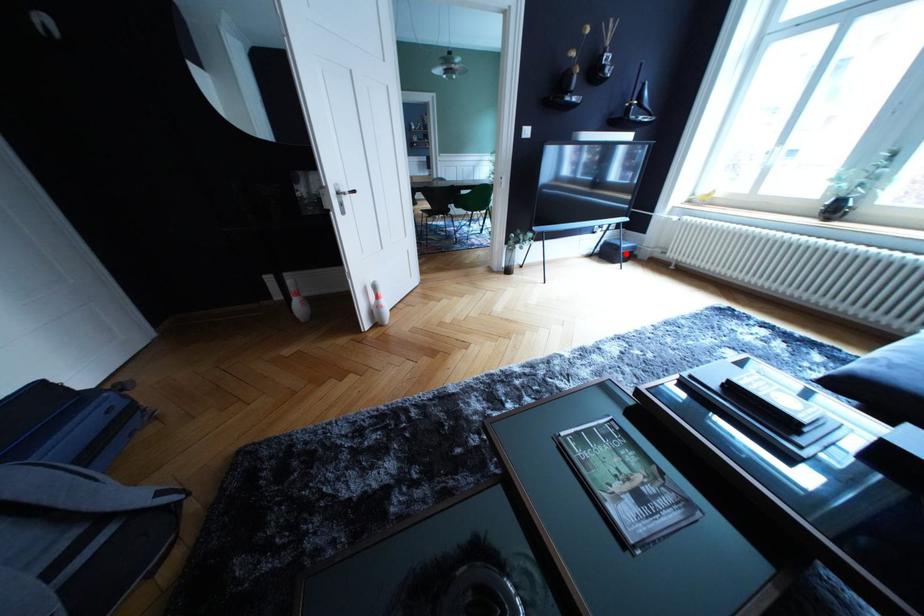
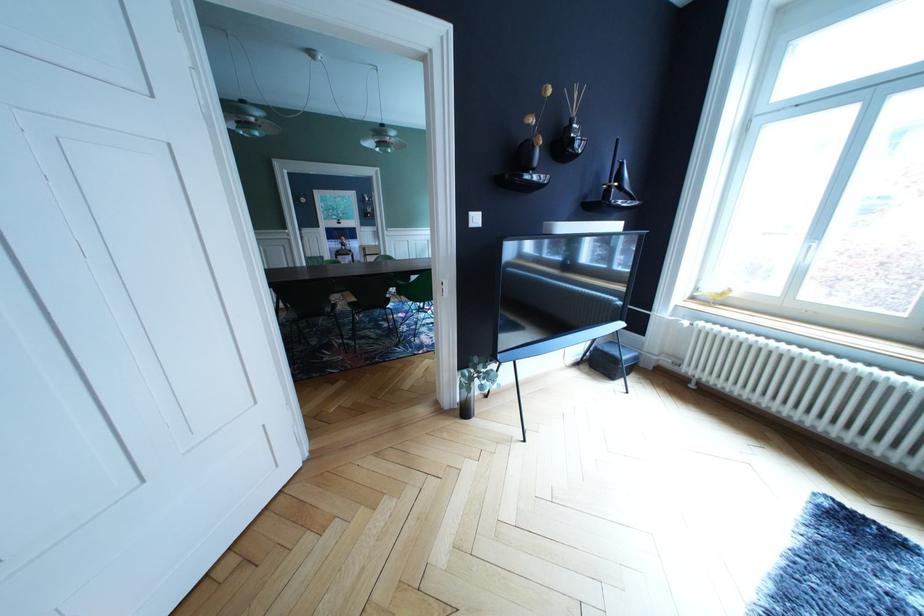
Question: I am providing you with two images of the same scene from different viewpoints. Image1 has a red point marked. In image2, the corresponding 3D location appears at what relative position? Reply with the corresponding letter.

Choices:
 (A) Closer
 (B) Farther

Answer: (B)